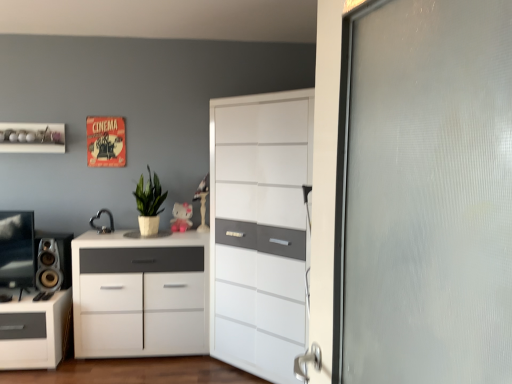
Question: Is white glossy shelf at upper left in front of or behind green matte plant at center in the image?

Choices:
 (A) behind
 (B) front

Answer: (A)

Question: From a real-world perspective, is white glossy shelf at upper left physically located above or below green matte plant at center?

Choices:
 (A) below
 (B) above

Answer: (B)

Question: Which of these objects is positioned closest to the metallic heart-shaped object at center?

Choices:
 (A) white matte cabinet at center, the 2th chest of drawers viewed from the right
 (B) white glossy cabinet at center, the second chest of drawers positioned from the left
 (C) matte black speaker at left
 (D) white glossy shelf at upper left
 (E) matte pink plastic toy at center

Answer: (C)

Question: Considering the real-world distances, which object is closest to the white glossy cabinet at center, the second chest of drawers positioned from the left?

Choices:
 (A) white glossy shelf at upper left
 (B) white matte cabinet at center, the 2th chest of drawers viewed from the right
 (C) matte black speaker at left
 (D) matte pink plastic toy at center
 (E) metallic heart-shaped object at center

Answer: (B)